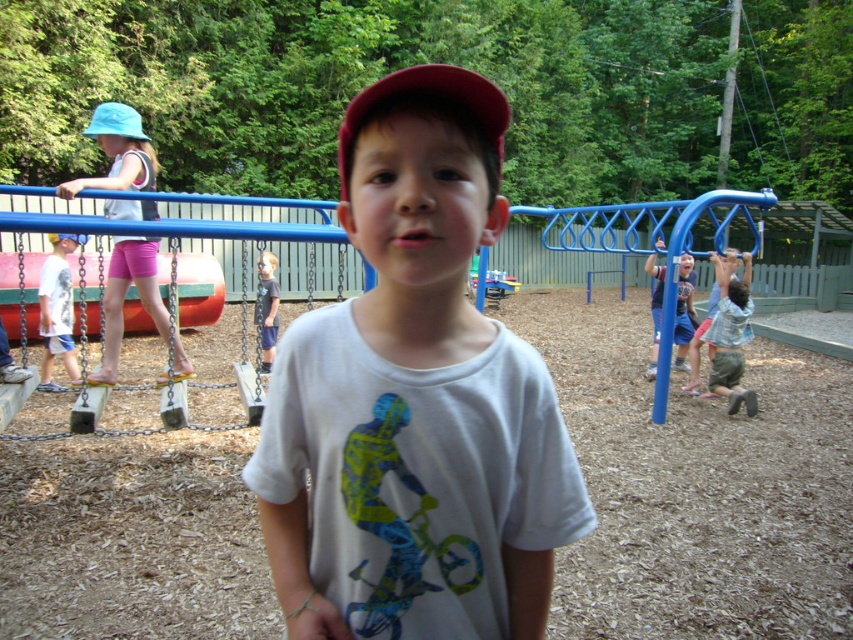
You are a photographer trying to capture the light blue fabric hat at upper left in your shot. The camera you are using has a focal length of 50mm. If the hat is located at coordinates point 0.466, 0.145, can you estimate whether the hat will be in the frame?

The light blue fabric hat at upper left is positioned at point (123, 298). Since the coordinates are within the standard image frame range of 0 to 1, the hat will be within the frame.

You are a photographer trying to capture both the light blue fabric hat at upper left and the red matte baseball cap at center in the same frame. Which object should you focus on first if you want to ensure both are in focus, considering their sizes?

The light blue fabric hat at upper left has a smaller width than the red matte baseball cap at center, so you should focus on the larger red matte baseball cap at center first to ensure both are in focus.